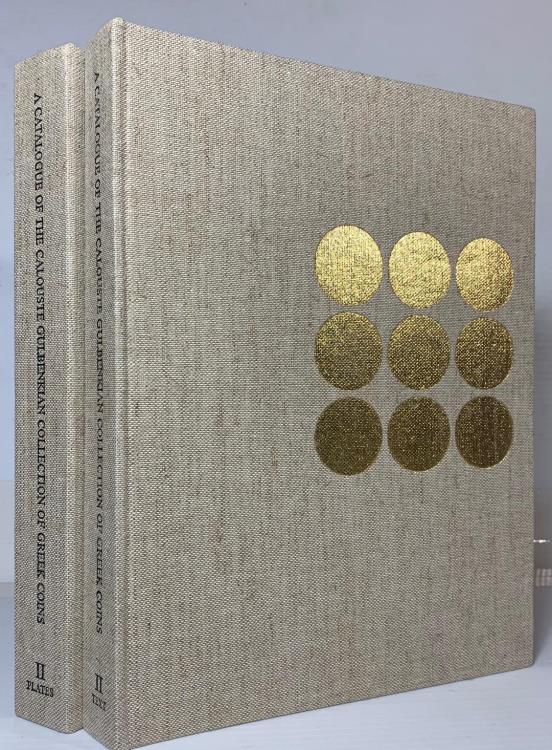
Identify the location of white surface. The width and height of the screenshot is (552, 750). (495, 718).